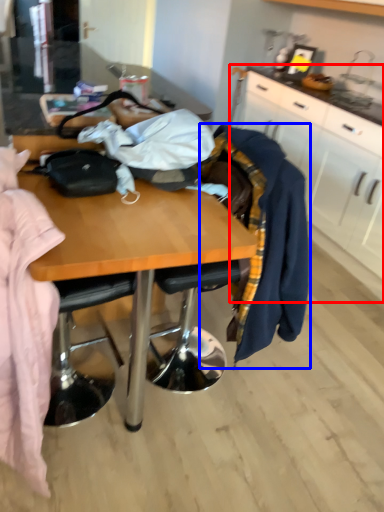
Question: Which point is closer to the camera, cabinetry (highlighted by a red box) or clothing (highlighted by a blue box)?

Choices:
 (A) cabinetry
 (B) clothing

Answer: (B)